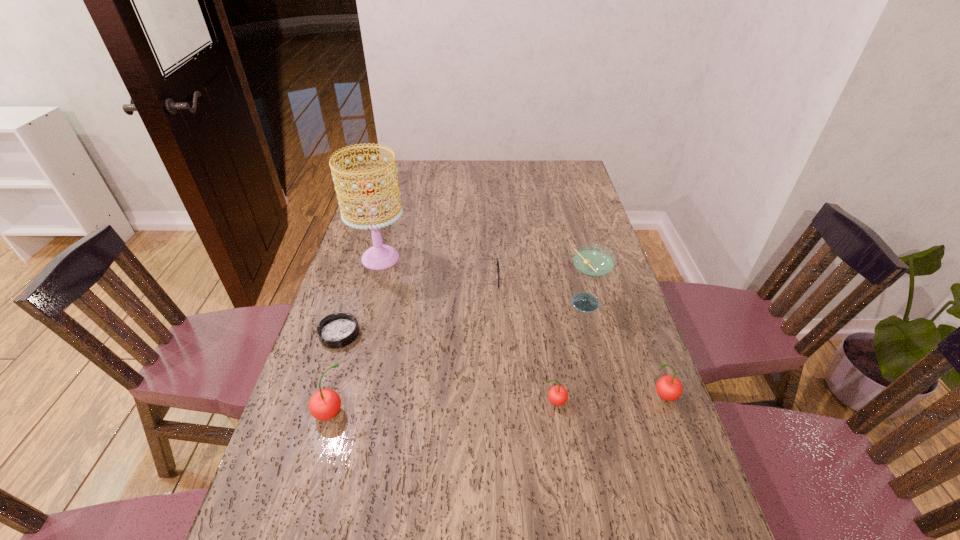
Find the location of a particular element. object that is the fourth nearest to the leftmost cherry is located at coordinates (380, 256).

Locate an element on the screen. the second closest cherry to the shortest object is located at coordinates (558, 395).

Locate which cherry is the second closest to the shortest cherry. Please provide its 2D coordinates. Your answer should be formatted as a tuple, i.e. [(x, y)], where the tuple contains the x and y coordinates of a point satisfying the conditions above.

[(324, 404)]

This screenshot has height=540, width=960. Identify the location of blank space that satisfies the following two spatial constraints: 1. through the lenses of the second cherry from left to right; 2. on the right side of the second shortest object. (477, 402).